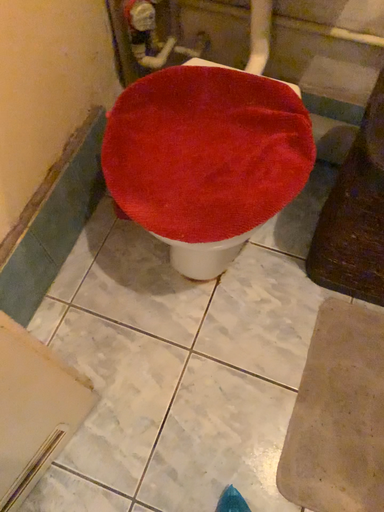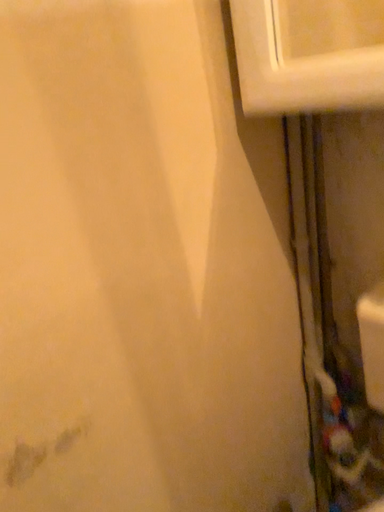
Question: How did the camera likely rotate when shooting the video?

Choices:
 (A) rotated downward
 (B) rotated upward

Answer: (B)